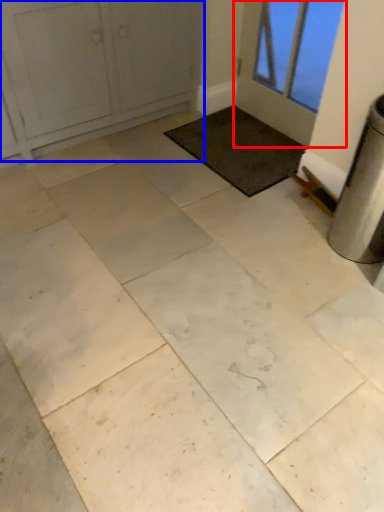
Question: Which object appears farthest to the camera in this image, door (highlighted by a red box) or door (highlighted by a blue box)?

Choices:
 (A) door
 (B) door

Answer: (A)